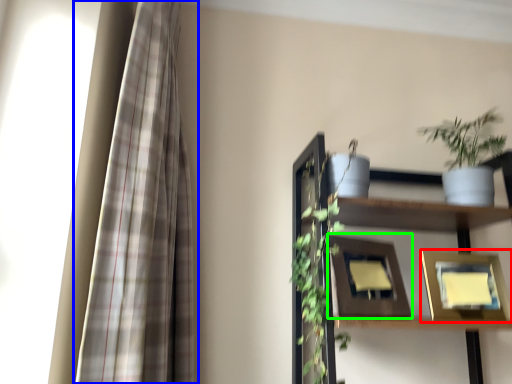
Question: Considering the real-world distances, which object is farthest from picture frame (highlighted by a red box)? curtain (highlighted by a blue box) or picture frame (highlighted by a green box)?

Choices:
 (A) curtain
 (B) picture frame

Answer: (A)